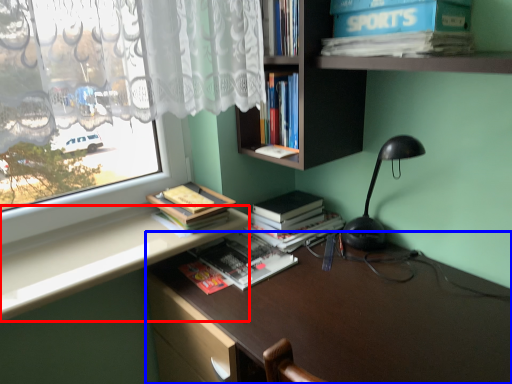
Question: Which point is further to the camera, counter top (highlighted by a red box) or desk (highlighted by a blue box)?

Choices:
 (A) counter top
 (B) desk

Answer: (A)